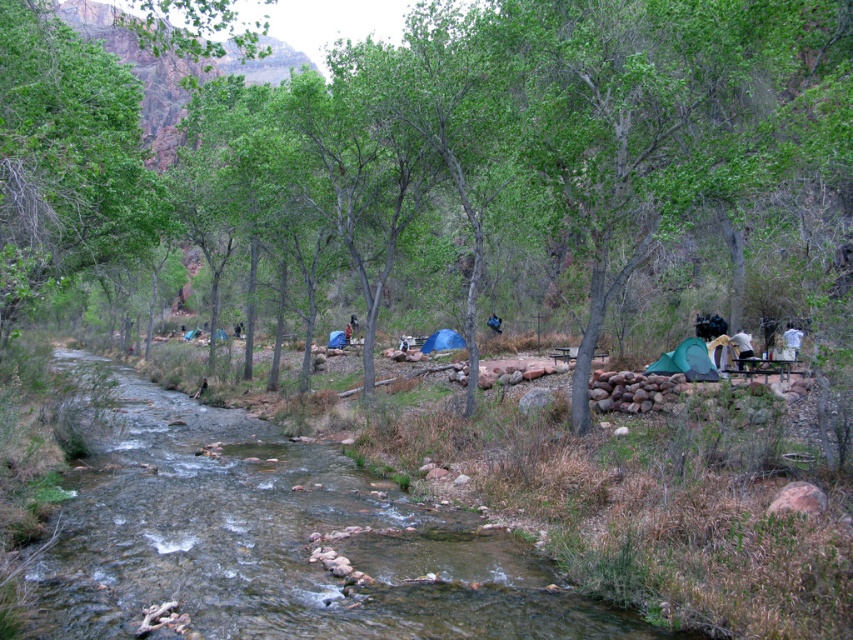
Question: Can you confirm if green fabric tent at lower right is thinner than blue fabric tent at center?

Choices:
 (A) no
 (B) yes

Answer: (B)

Question: Which of the following is the farthest from the observer?

Choices:
 (A) (328, 632)
 (B) (430, 339)
 (C) (676, 356)
 (D) (393, 220)

Answer: (B)

Question: Is the position of green leafy tree at center less distant than that of blue fabric tent at center?

Choices:
 (A) yes
 (B) no

Answer: (A)

Question: Estimate the real-world distances between objects in this image. Which object is closer to the blue fabric tent at center?

Choices:
 (A) clear water stream at center
 (B) green fabric tent at lower right
 (C) green leafy tree at center

Answer: (C)

Question: Which object appears closest to the camera in this image?

Choices:
 (A) green leafy tree at center
 (B) blue fabric tent at center

Answer: (A)

Question: Is clear water stream at center further to the viewer compared to blue fabric tent at center?

Choices:
 (A) yes
 (B) no

Answer: (B)